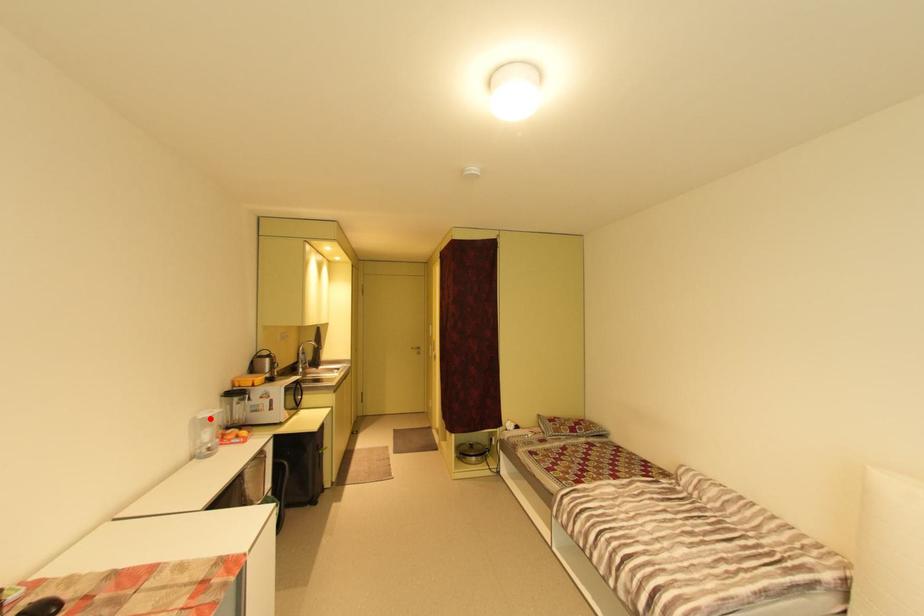
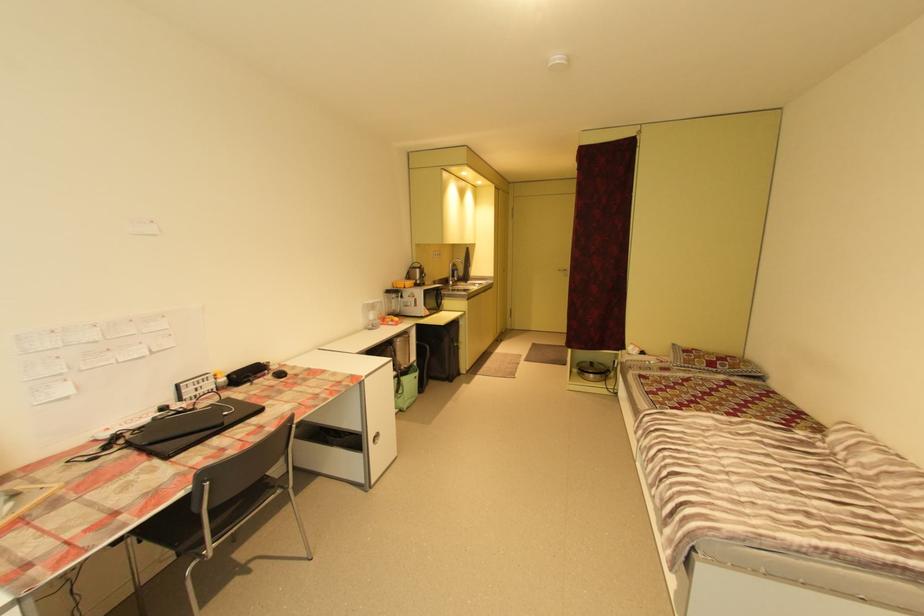
Find the pixel in the second image that matches the highlighted location in the first image.

(374, 304)